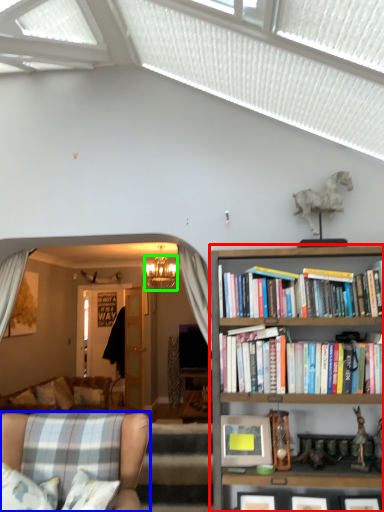
Question: Estimate the real-world distances between objects in this image. Which object is closer to bookcase (highlighted by a red box), chair (highlighted by a blue box) or lamp (highlighted by a green box)?

Choices:
 (A) chair
 (B) lamp

Answer: (A)